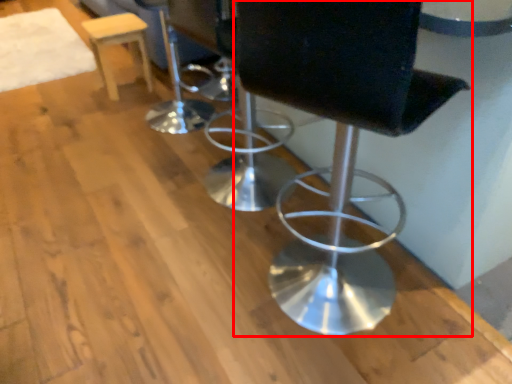
Question: From the image's perspective, considering the relative positions of chair (annotated by the red box) and stool in the image provided, where is chair (annotated by the red box) located with respect to the staircase?

Choices:
 (A) above
 (B) below

Answer: (B)